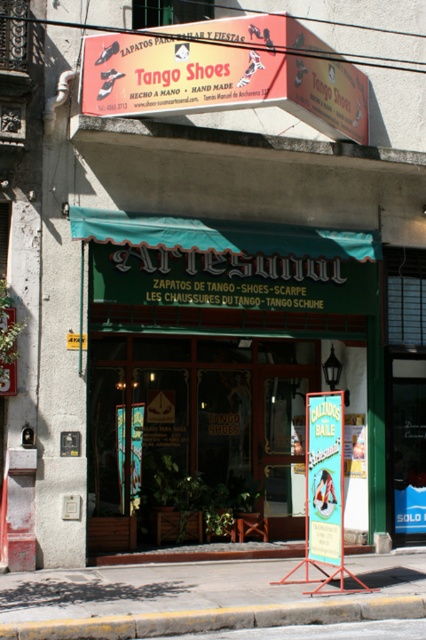
You are a customer standing in front of the Tango Shoes store. You notice the green wooden sign at center and the yellow concrete curb at lower center. Which object is taller?

The green wooden sign at center is taller than the yellow concrete curb at lower center.

You are a tourist standing in front of the Tango Shoes store. You see the green wooden sign at center and the yellow concrete curb at lower center. Which object is located above the other?

The green wooden sign at center is positioned over the yellow concrete curb at lower center, so the green wooden sign at center is above the yellow concrete curb at lower center.

You are a tourist visiting the shop and want to read both the green wooden sign at center and the green fabric sign at center. Which sign should you stand closer to in order to read its text clearly?

The green wooden sign at center is larger in size than the green fabric sign at center, so you should stand closer to the green fabric sign at center to read its text clearly.